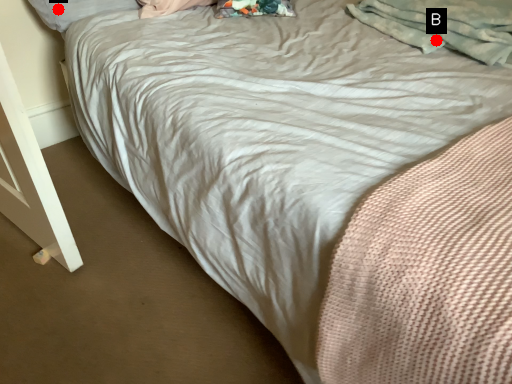
Question: Two points are circled on the image, labeled by A and B beside each circle. Which point is farther from the camera taking this photo?

Choices:
 (A) A is further
 (B) B is further

Answer: (A)